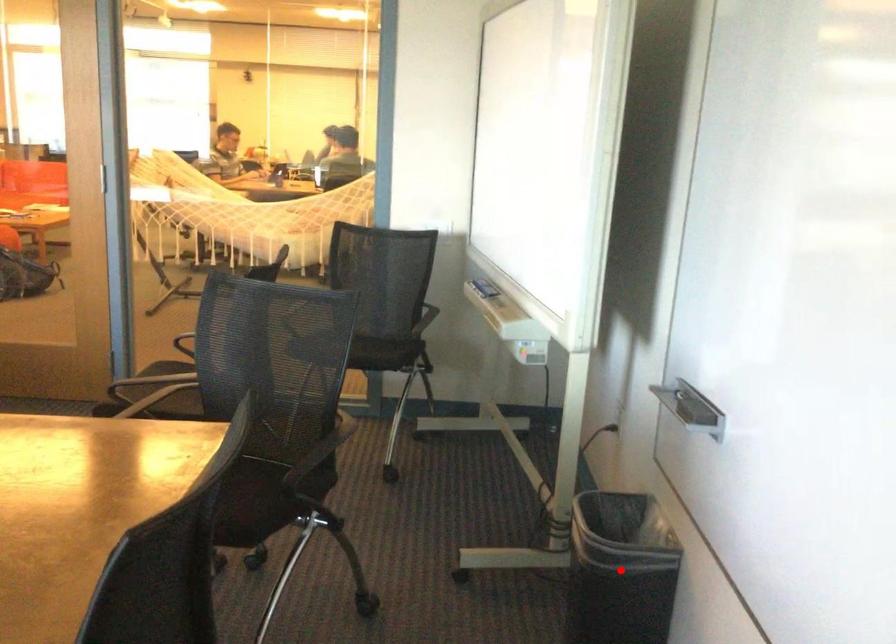
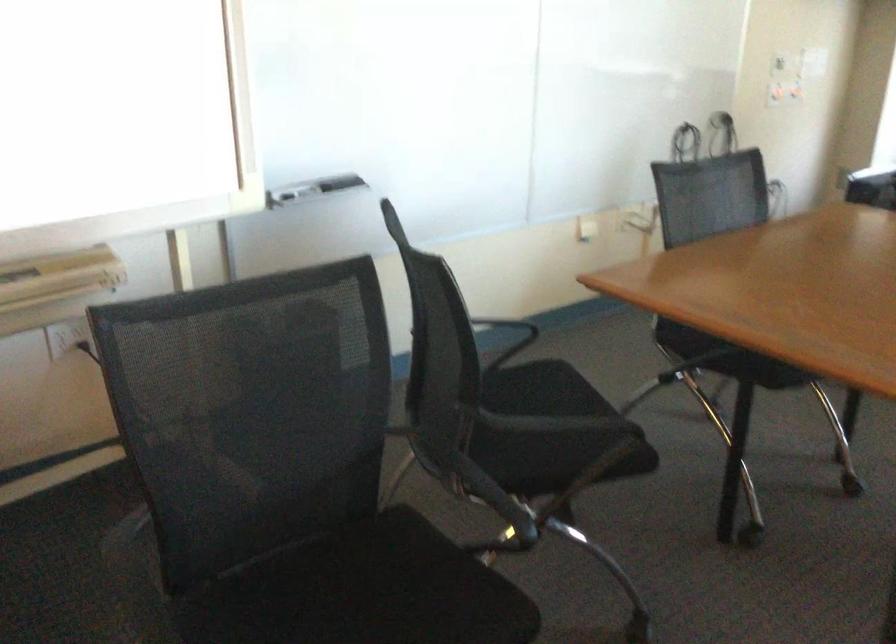
Question: I am providing you with two images of the same scene from different viewpoints. A red point is marked on the first image. Is the red point's position out of view in image 2?

Choices:
 (A) Yes
 (B) No

Answer: (A)